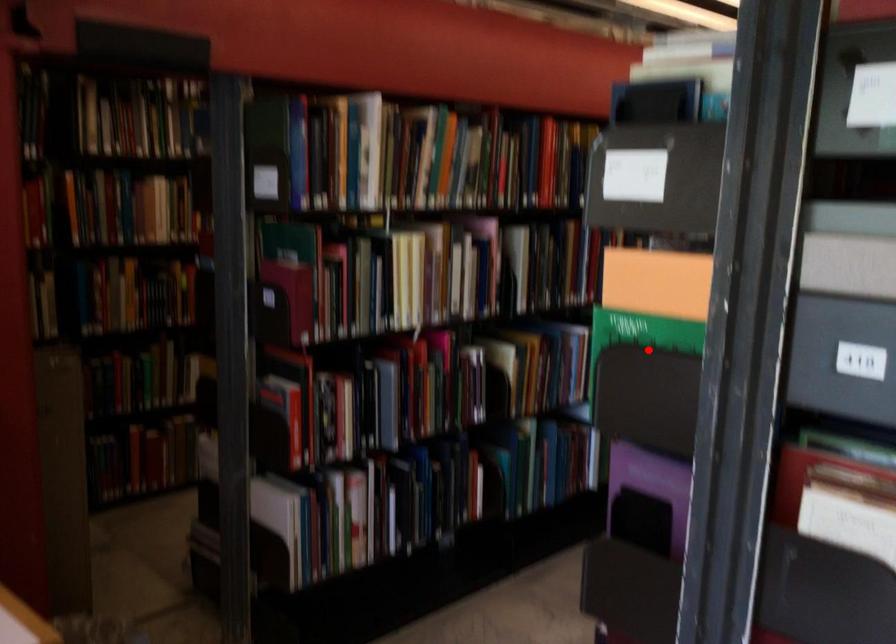
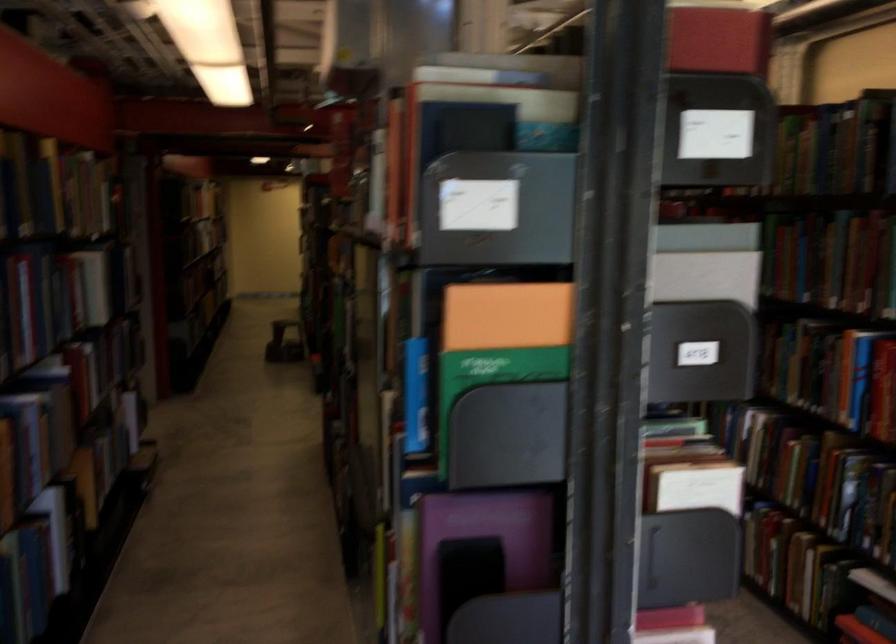
Locate, in the second image, the point that corresponds to the highlighted location in the first image.

(416, 395)